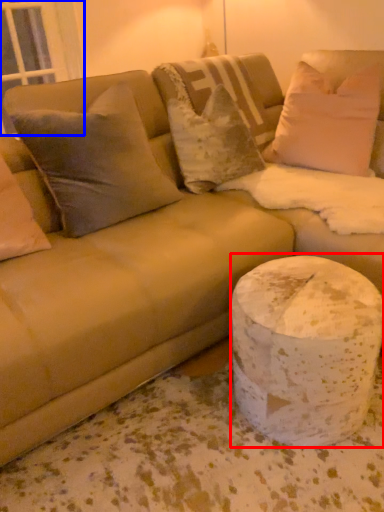
Question: Which point is further to the camera, marble (highlighted by a red box) or window screen (highlighted by a blue box)?

Choices:
 (A) marble
 (B) window screen

Answer: (B)